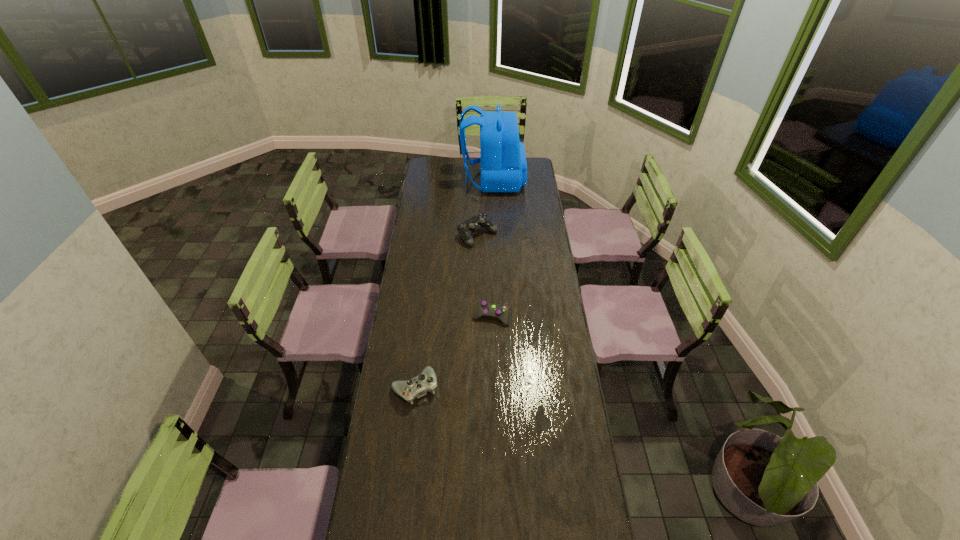
Find the location of a particular element. The height and width of the screenshot is (540, 960). vacant area that lies between the leftmost control and the second farthest object is located at coordinates (446, 312).

The width and height of the screenshot is (960, 540). Find the location of `free space between the nearest control and the backpack`. free space between the nearest control and the backpack is located at coordinates (454, 284).

Identify which object is the third closest to the shortest control. Please provide its 2D coordinates. Your answer should be formatted as a tuple, i.e. [(x, y)], where the tuple contains the x and y coordinates of a point satisfying the conditions above.

[(503, 161)]

Select which object is the third closest to the leftmost control. Please provide its 2D coordinates. Your answer should be formatted as a tuple, i.e. [(x, y)], where the tuple contains the x and y coordinates of a point satisfying the conditions above.

[(503, 161)]

Identify the location of control that is the second closest to the farthest object. This screenshot has width=960, height=540. (483, 308).

What are the coordinates of `the second closest control to the backpack` in the screenshot? It's located at point(483,308).

Find the location of a particular element. This screenshot has height=540, width=960. vacant region that satisfies the following two spatial constraints: 1. on the back side of the third nearest object; 2. on the left side of the third tallest object is located at coordinates (433, 235).

Identify the location of vacant space that satisfies the following two spatial constraints: 1. on the back of the tallest object; 2. on the front side of the tallest control. This screenshot has width=960, height=540. (495, 235).

You are a GUI agent. You are given a task and a screenshot of the screen. Output one action in this format:
    pyautogui.click(x=<x>, y=<y>)
    Task: Click on the free spot that satisfies the following two spatial constraints: 1. on the front side of the farthest control; 2. on the left side of the shortest object
    This screenshot has width=960, height=540.
    Given the screenshot: What is the action you would take?
    pyautogui.click(x=477, y=316)